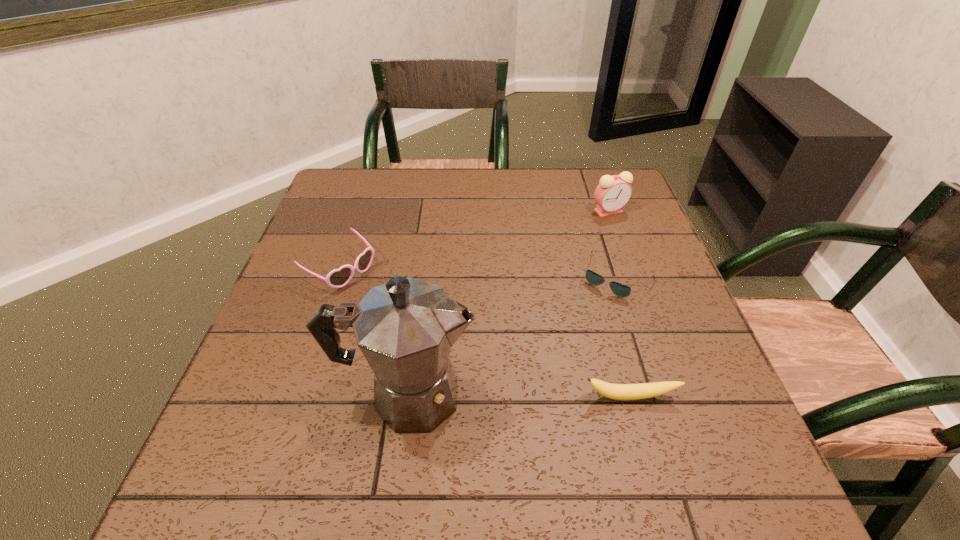
This screenshot has height=540, width=960. Find the location of `vacant space located 0.180m on the face of the farthest object`. vacant space located 0.180m on the face of the farthest object is located at coordinates (591, 258).

You are a GUI agent. You are given a task and a screenshot of the screen. Output one action in this format:
    pyautogui.click(x=<x>, y=<y>)
    Task: Click on the vacant space located on the face of the farthest object
    
    Given the screenshot: What is the action you would take?
    pyautogui.click(x=571, y=320)

Locate an element on the screen. This screenshot has height=540, width=960. vacant region located on the lenses of the right sunglasses is located at coordinates (564, 349).

This screenshot has width=960, height=540. I want to click on vacant space located on the lenses of the right sunglasses, so click(552, 366).

Where is `vacant area situated on the lenses of the right sunglasses`? vacant area situated on the lenses of the right sunglasses is located at coordinates coord(540,384).

I want to click on free region located on the front-facing side of the left sunglasses, so click(x=399, y=309).

You are a GUI agent. You are given a task and a screenshot of the screen. Output one action in this format:
    pyautogui.click(x=<x>, y=<y>)
    Task: Click on the free space located on the front-facing side of the left sunglasses
    This screenshot has width=960, height=540.
    Given the screenshot: What is the action you would take?
    pyautogui.click(x=500, y=377)

The height and width of the screenshot is (540, 960). In order to click on free space located 0.270m on the front-facing side of the left sunglasses in this screenshot , I will do `click(449, 343)`.

This screenshot has width=960, height=540. Find the location of `object located in the far edge section of the desktop`. object located in the far edge section of the desktop is located at coordinates (613, 192).

This screenshot has width=960, height=540. I want to click on coffeepot at the near edge, so click(405, 328).